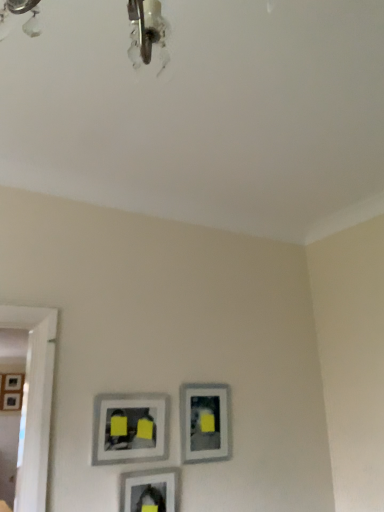
Question: From their relative heights in the image, would you say matte gray picture frame at center, which is the fourth picture frame in bottom-to-top order, is taller or shorter than matte gray picture frame at lower center, the 3th picture frame viewed from the top?

Choices:
 (A) tall
 (B) short

Answer: (B)

Question: Is point (155, 417) positioned closer to the camera than point (144, 487)?

Choices:
 (A) closer
 (B) farther

Answer: (B)

Question: Estimate the real-world distances between objects in this image. Which object is closer to the matte gray picture frame at lower center, which is the 2th picture frame in right-to-left order?

Choices:
 (A) matte gray picture frame at center, placed as the second picture frame when sorted from top to bottom
 (B) matte gray picture frame at left, which is the 4th picture frame in right-to-left order
 (C) matte gray picture frame at center, positioned as the first picture frame in top-to-bottom order

Answer: (C)

Question: Estimate the real-world distances between objects in this image. Which object is farther from the matte gray picture frame at center, positioned as the first picture frame in right-to-left order?

Choices:
 (A) matte gray picture frame at lower center, which is the 2th picture frame in right-to-left order
 (B) matte gray picture frame at center, the third picture frame positioned from the back
 (C) matte gray picture frame at left, which ranks as the first picture frame in bottom-to-top order

Answer: (C)